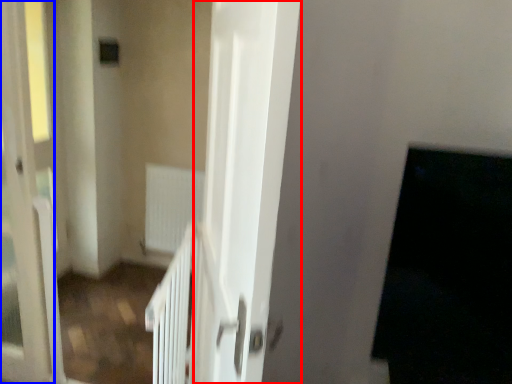
Question: Which object appears closest to the camera in this image, screen door (highlighted by a red box) or screen door (highlighted by a blue box)?

Choices:
 (A) screen door
 (B) screen door

Answer: (A)